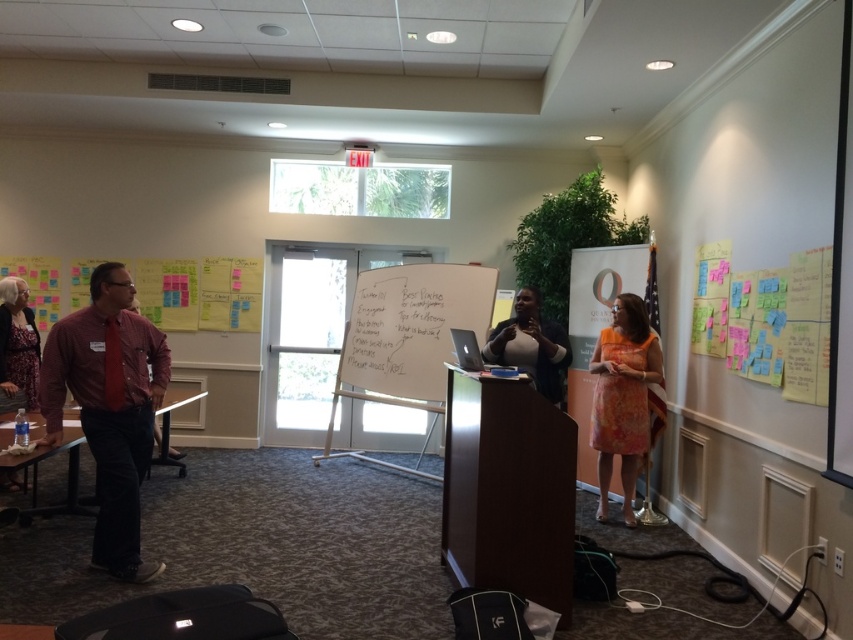
Question: Can you confirm if plaid shirt at left is positioned below matte black shirt at left?

Choices:
 (A) no
 (B) yes

Answer: (B)

Question: Observing the image, what is the correct spatial positioning of plaid shirt at left in reference to matte black shirt at left?

Choices:
 (A) left
 (B) right

Answer: (B)

Question: Can you confirm if plaid shirt at left is wider than matte black shirt at left?

Choices:
 (A) no
 (B) yes

Answer: (B)

Question: Which of the following is the farthest from the observer?

Choices:
 (A) (498, 364)
 (B) (453, 316)
 (C) (15, 477)
 (D) (96, 422)

Answer: (B)

Question: Estimate the real-world distances between objects in this image. Which object is closer to the plaid shirt at left?

Choices:
 (A) whiteboard at center
 (B) orange floral dress at right
 (C) dark blue sweater at center

Answer: (C)

Question: Among these points, which one is farthest from the camera?

Choices:
 (A) (540, 320)
 (B) (20, 364)
 (C) (149, 449)

Answer: (B)